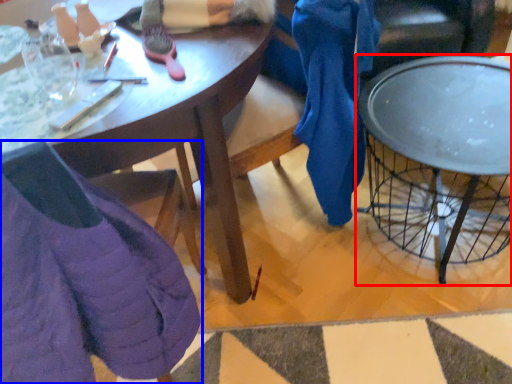
Question: Which object is further to the camera taking this photo, coffee table (highlighted by a red box) or chair (highlighted by a blue box)?

Choices:
 (A) coffee table
 (B) chair

Answer: (A)